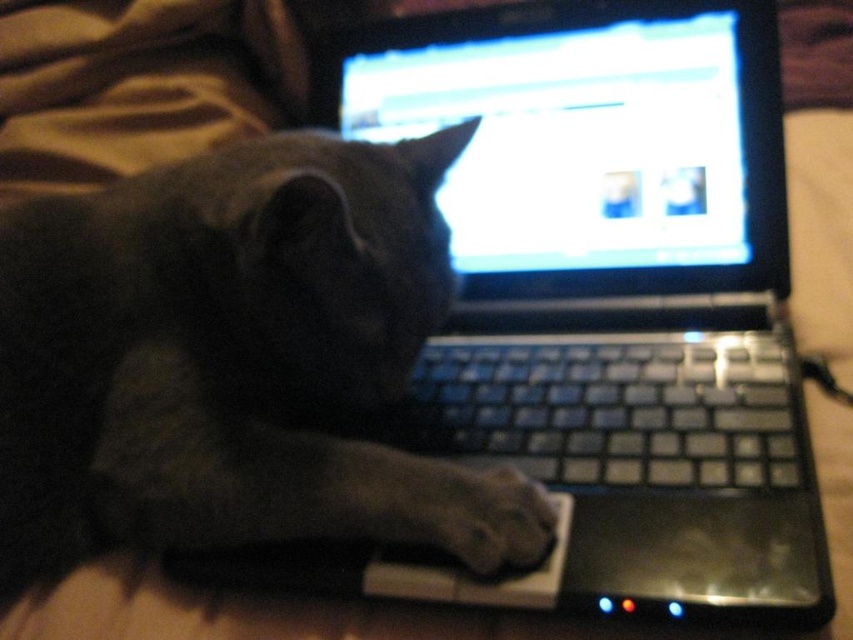
In the scene shown: You are a pet sitter who needs to clean the laptop keyboard. You see the black plastic keyboard at center and the gray fur paw at lower center. Which object is bigger and requires more space to clean around?

The black plastic keyboard at center is larger in size than the gray fur paw at lower center, so it requires more space to clean around.

You are a photographer trying to capture a clear photo of the black plastic laptop at center and the gray fur paw at lower center. Which object will appear larger in the photo?

The black plastic laptop at center will appear larger in the photo because it is closer to the viewer than the gray fur paw at lower center.

You are a pet sitter who needs to clean the laptop keyboard. You see the black plastic keyboard at center and the gray fur paw at lower center. Which object is closer to the top edge of the laptop screen?

The black plastic keyboard at center is located above the gray fur paw at lower center, so it is closer to the top edge of the laptop screen.